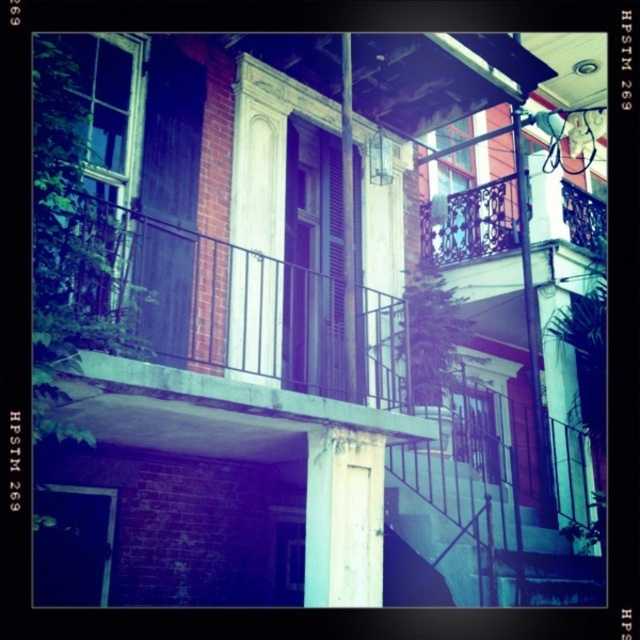
Looking at the multi story building, which of the two clear glass windows is positioned further to the left? The clear glass window at upper left or the clear glass window at upper center?

The clear glass window at upper left is positioned to the left of the clear glass window at upper center, so it is further to the left.

Looking at the building from the street, which object would appear closer to the left side? The rustic wood balcony at center or the clear glass window at upper center?

The rustic wood balcony at center is positioned to the left of the clear glass window at upper center, so it would appear closer to the left side when viewed from the street.

You are an architect evaluating the building facade. You need to install a new security camera. The camera requires a mounting surface that can accommodate its size. Given the rustic wood balcony at center and the clear glass window at upper center, which object would provide a more stable and sufficient surface for installation based on their sizes?

The rustic wood balcony at center is larger in size than the clear glass window at upper center, so it would provide a more stable and sufficient surface for installing the security camera.